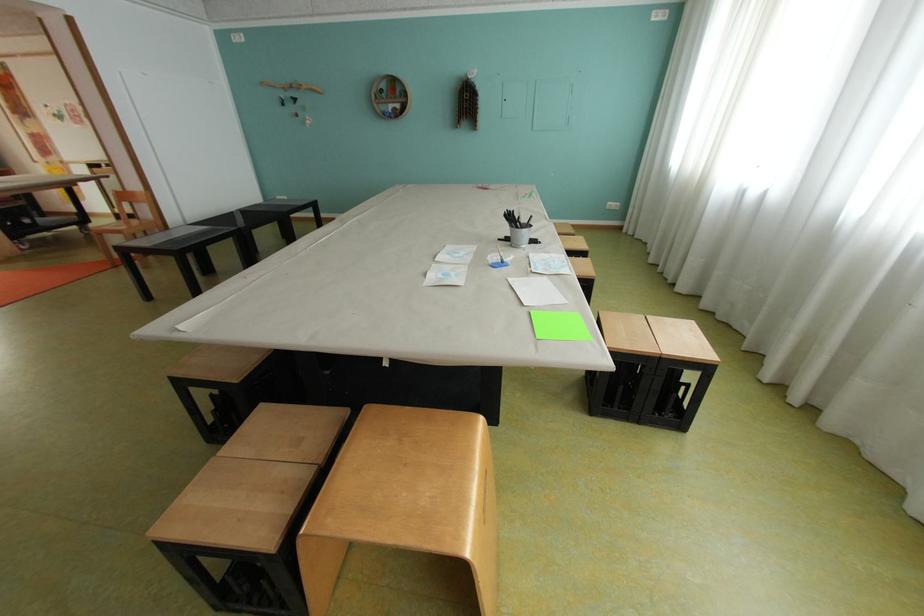
This screenshot has width=924, height=616. I want to click on black brush, so click(x=513, y=219).